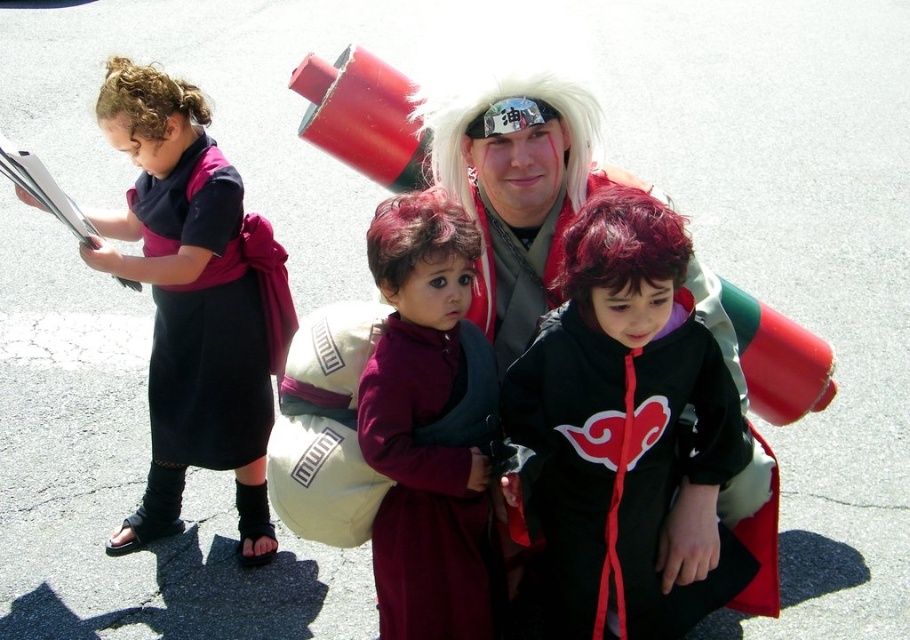
You are trying to decide which object is larger between the velvet maroon robe at center and the curly hair at upper left. Based on the scene description, which one is larger?

The velvet maroon robe at center is bigger than curly hair at upper left, so the velvet maroon robe at center is larger.

You are a photographer at the scene. You need to place a reflector to bounce light onto the shiny red wig at center located at point (620, 244). Where should you position the reflector relative to the wig to best utilize the daylight?

The reflector should be positioned to the side opposite of the sun relative to the shiny red wig at center at point (620, 244) to effectively bounce light onto it.